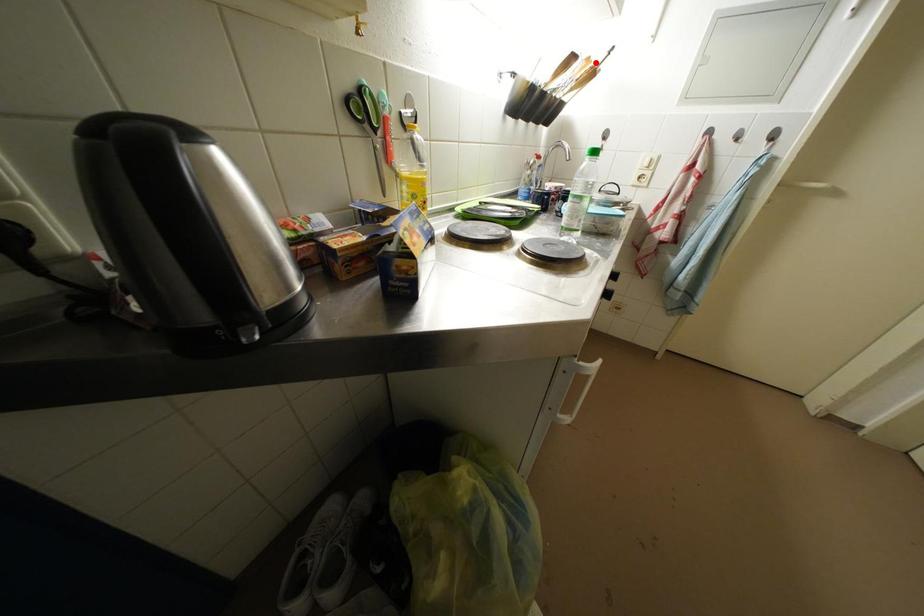
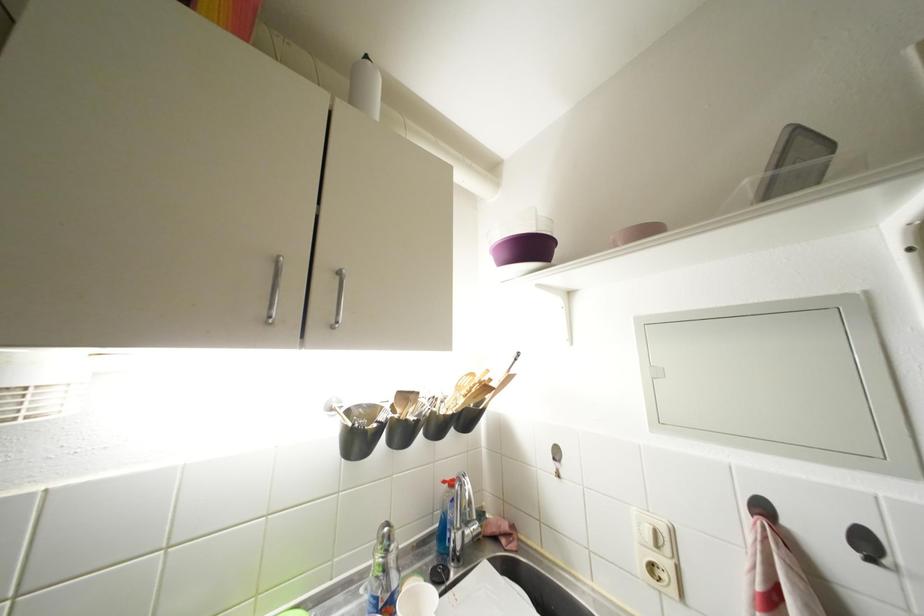
Where in the second image is the point corresponding to the highlighted location from the first image?

(479, 379)